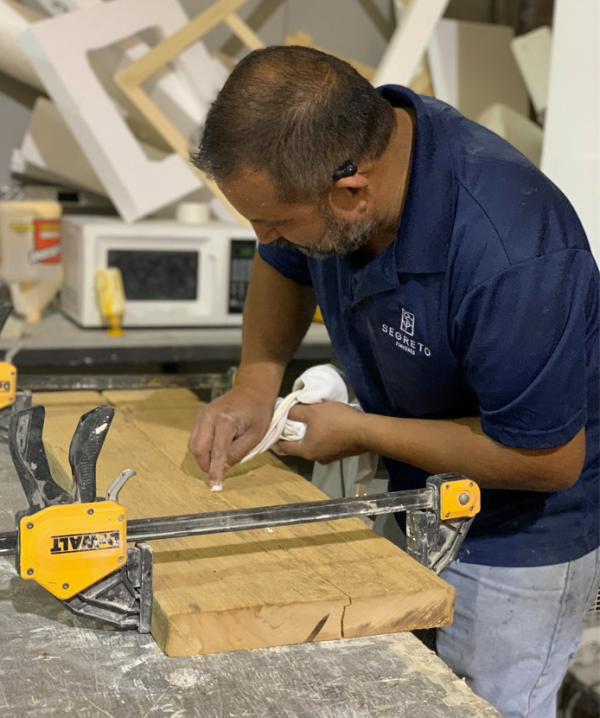
This screenshot has height=718, width=600. In order to click on wooden work bench in this screenshot , I will do `click(290, 671)`.